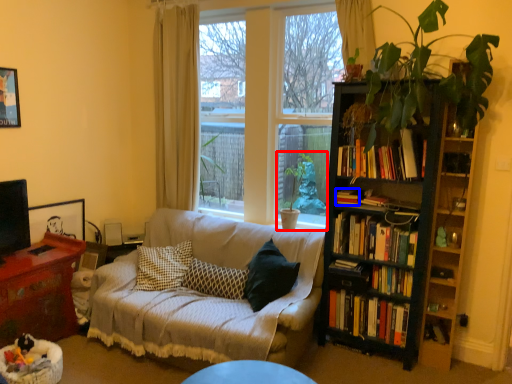
Question: Which of the following is the farthest to the observer, houseplant (highlighted by a red box) or book (highlighted by a blue box)?

Choices:
 (A) houseplant
 (B) book

Answer: (A)